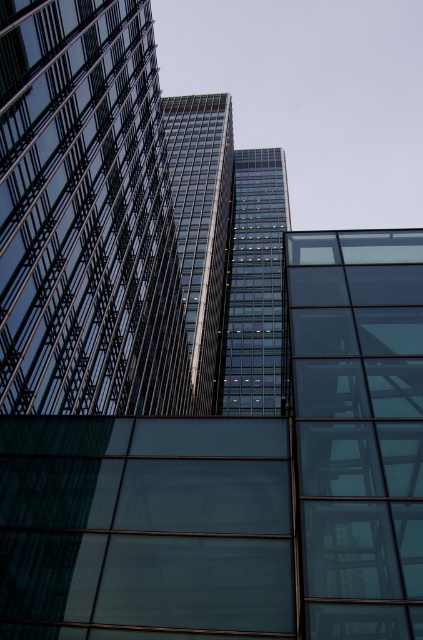
Question: Does transparent glass building at center have a lesser width compared to glassy steel tower at center?

Choices:
 (A) yes
 (B) no

Answer: (A)

Question: Which of the following is the closest to the observer?

Choices:
 (A) glassy steel tower at center
 (B) transparent glass building at center

Answer: (B)

Question: Which of the following is the closest to the observer?

Choices:
 (A) (247, 349)
 (B) (14, 1)

Answer: (B)

Question: Is glassy reflective tower at center behind glassy steel tower at center?

Choices:
 (A) no
 (B) yes

Answer: (A)

Question: Which object appears closest to the camera in this image?

Choices:
 (A) glassy steel tower at center
 (B) transparent glass building at center
 (C) glassy reflective tower at center

Answer: (B)

Question: Is transparent glass building at center bigger than glassy steel tower at center?

Choices:
 (A) no
 (B) yes

Answer: (A)